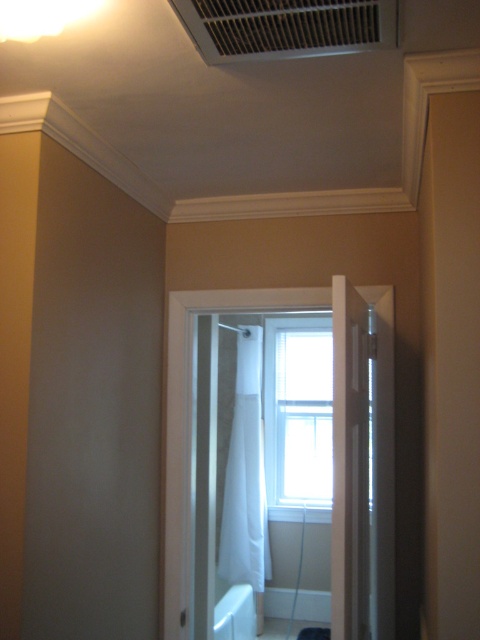
You are standing in the hallway and want to enter the bathroom. You notice the white plastic air conditioner at upper center and the white fabric shower curtain at center. Which object is positioned more to the right side of the bathroom?

The white plastic air conditioner at upper center is positioned more to the right side of the bathroom compared to the white fabric shower curtain at center.

You are a technician trying to install a new air conditioner unit. The existing white plastic air conditioner at upper center is located at coordinates point 0.042, 0.598. If you need to place a new unit 0.1 units to the right of the existing one, what would be the new coordinates?

The new coordinates would be calculated by adding 0.1 to the x coordinate of the existing white plastic air conditioner at upper center. The original x coordinate is 0.042, so adding 0.1 gives 0.142. The y coordinate remains 0.598. Therefore, the new coordinates are point [287,90].